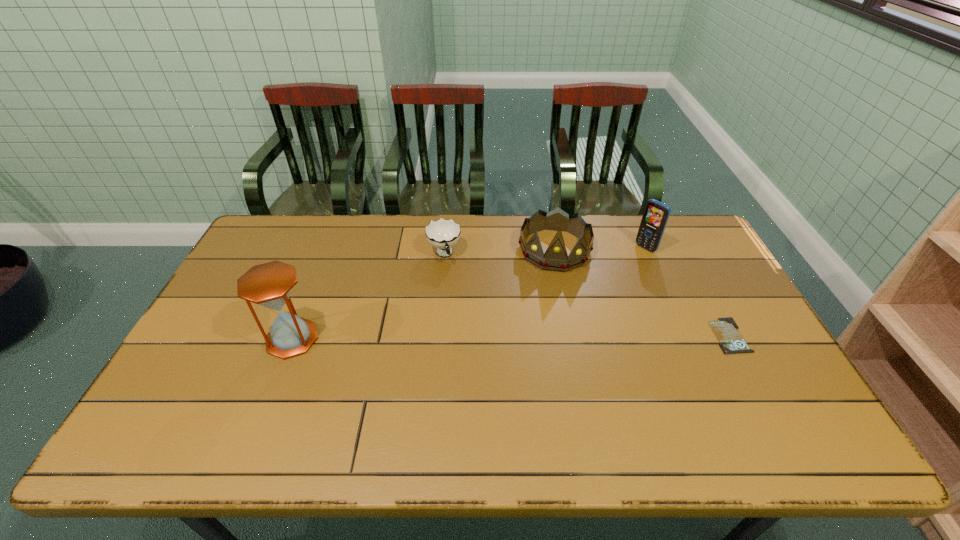
Locate an element on the screen. The width and height of the screenshot is (960, 540). cup located at the far edge is located at coordinates (443, 234).

Where is `cellular telephone present at the far edge`? This screenshot has height=540, width=960. cellular telephone present at the far edge is located at coordinates (656, 214).

This screenshot has width=960, height=540. I want to click on object that is at the right edge, so click(x=731, y=341).

This screenshot has width=960, height=540. I want to click on vacant region at the far edge of the desktop, so point(372,217).

The width and height of the screenshot is (960, 540). In order to click on vacant space at the near edge of the desktop in this screenshot , I will do `click(312, 394)`.

The height and width of the screenshot is (540, 960). Find the location of `vacant space at the left edge`. vacant space at the left edge is located at coordinates (218, 361).

At what (x,y) coordinates should I click in order to perform the action: click on free space at the right edge. Please return your answer as a coordinate pair (x, y). This screenshot has width=960, height=540. Looking at the image, I should click on (715, 269).

Locate an element on the screen. free space at the far left corner is located at coordinates (287, 245).

Where is `free space at the near left corner of the desktop`? Image resolution: width=960 pixels, height=540 pixels. free space at the near left corner of the desktop is located at coordinates (162, 404).

This screenshot has width=960, height=540. I want to click on free space at the far right corner of the desktop, so [x=684, y=223].